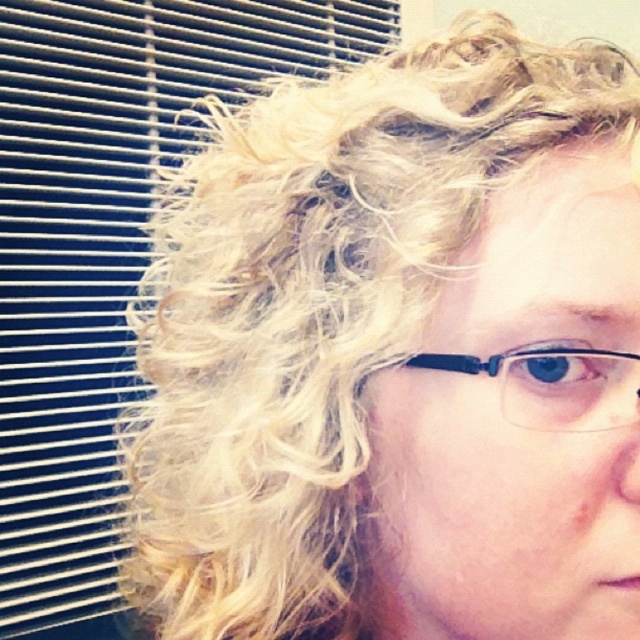
Question: Which of the following is the closest to the observer?

Choices:
 (A) clear plastic glasses at center
 (B) matte plastic hair at upper right

Answer: (A)

Question: Among these points, which one is nearest to the camera?

Choices:
 (A) [x=40, y=401]
 (B) [x=637, y=381]

Answer: (B)

Question: Is matte plastic hair at upper right below clear plastic glasses at center?

Choices:
 (A) yes
 (B) no

Answer: (B)

Question: Does matte plastic hair at upper right appear over clear plastic glasses at center?

Choices:
 (A) no
 (B) yes

Answer: (B)

Question: Which point appears farthest from the camera in this image?

Choices:
 (A) (518, 356)
 (B) (136, 177)

Answer: (B)

Question: Does matte plastic hair at upper right have a smaller size compared to clear plastic glasses at center?

Choices:
 (A) no
 (B) yes

Answer: (A)